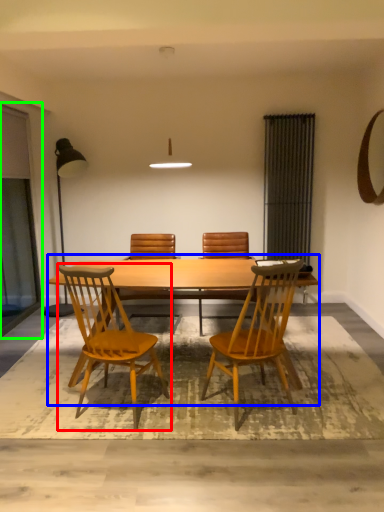
Question: Estimate the real-world distances between objects in this image. Which object is closer to chair (highlighted by a red box), kitchen & dining room table (highlighted by a blue box) or screen door (highlighted by a green box)?

Choices:
 (A) kitchen & dining room table
 (B) screen door

Answer: (A)